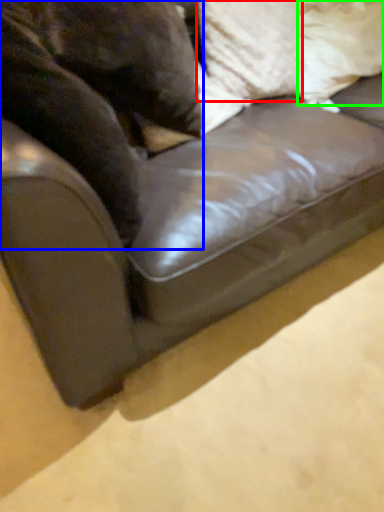
Question: Which object is the farthest from pillow (highlighted by a red box)? Choose among these: animal (highlighted by a blue box) or pillow (highlighted by a green box).

Choices:
 (A) animal
 (B) pillow

Answer: (A)